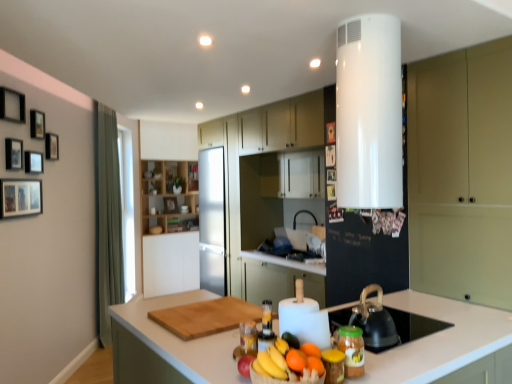
This screenshot has height=384, width=512. I want to click on white glossy water heater at upper center, so click(x=369, y=113).

What do you see at coordinates (330, 155) in the screenshot? This screenshot has width=512, height=384. I see `wooden picture frame at upper center, marked as the fourth picture frame in a right-to-left arrangement` at bounding box center [330, 155].

Find the location of `orange matte at center, arranged as the 1th orange when viewed from the back`. orange matte at center, arranged as the 1th orange when viewed from the back is located at coordinates pyautogui.click(x=310, y=350).

Who is bigger, wooden picture frame at upper left, marked as the third picture frame in a front-to-back arrangement, or wooden picture frame at upper center, placed as the 2th picture frame when sorted from right to left?

wooden picture frame at upper left, marked as the third picture frame in a front-to-back arrangement, is bigger.

Is wooden picture frame at upper left, the 9th picture frame viewed from the back, aimed at wooden picture frame at upper center, arranged as the tenth picture frame when viewed from the left?

Yes, wooden picture frame at upper left, the 9th picture frame viewed from the back, is turned towards wooden picture frame at upper center, arranged as the tenth picture frame when viewed from the left.

Looking at this image, which is more to the left, wooden picture frame at upper center, marked as the fifth picture frame in a back-to-front arrangement, or wooden picture frame at center, which ranks as the first picture frame in back-to-front order?

From the viewer's perspective, wooden picture frame at center, which ranks as the first picture frame in back-to-front order, appears more on the left side.

Based on their sizes in the image, would you say wooden picture frame at upper center, marked as the fourth picture frame in a right-to-left arrangement, is bigger or smaller than wooden picture frame at center, the seventh picture frame positioned from the left?

Considering their sizes, wooden picture frame at upper center, marked as the fourth picture frame in a right-to-left arrangement, takes up less space than wooden picture frame at center, the seventh picture frame positioned from the left.

From the image's perspective, is wooden picture frame at upper center, the 8th picture frame in the left-to-right sequence, beneath wooden picture frame at center, acting as the eleventh picture frame starting from the front?

Incorrect, from the image's perspective, wooden picture frame at upper center, the 8th picture frame in the left-to-right sequence, is higher than wooden picture frame at center, acting as the eleventh picture frame starting from the front.

Which orange is the 3rd one when counting from the front of the wooden shelves at center, which is the first cabinetry in back-to-front order? Please provide its 2D coordinates.

[(296, 360)]

Is wooden shelves at center, marked as the fourth cabinetry in a front-to-back arrangement, far away from orange matte at center, the third orange in the back-to-front sequence?

wooden shelves at center, marked as the fourth cabinetry in a front-to-back arrangement, is positioned a significant distance from orange matte at center, the third orange in the back-to-front sequence.

Considering the points (174, 229) and (302, 357), which point is in front, point (174, 229) or point (302, 357)?

The point (302, 357) is more forward.

Can you confirm if wooden shelves at center, marked as the fourth cabinetry in a front-to-back arrangement, is taller than orange matte at center, which is the first orange in front-to-back order?

Yes.

From the image's perspective, starting from the wooden picture frame at upper left, which is counted as the 7th picture frame, starting from the back, which cabinetry is the 1st one below? Please provide its 2D coordinates.

[(292, 174)]

In the scene shown: Is matte white cabinet at center, which ranks as the 2th cabinetry in right-to-left order, not close to wooden picture frame at upper left, the 2th picture frame viewed from the left?

Yes.

Based on their positions, is matte white cabinet at center, which is counted as the second cabinetry, starting from the front, located to the left or right of wooden picture frame at upper left, the 2th picture frame viewed from the left?

Clearly, matte white cabinet at center, which is counted as the second cabinetry, starting from the front, is on the right of wooden picture frame at upper left, the 2th picture frame viewed from the left, in the image.

Do you think orange matte at center, which is the first orange in front-to-back order, is within wooden cutting board at center, or outside of it?

orange matte at center, which is the first orange in front-to-back order, exists outside the volume of wooden cutting board at center.

Considering the relative positions of orange matte at center, the third orange in the back-to-front sequence, and wooden cutting board at center in the image provided, is orange matte at center, the third orange in the back-to-front sequence, to the left or to the right of wooden cutting board at center?

Based on their positions, orange matte at center, the third orange in the back-to-front sequence, is located to the right of wooden cutting board at center.

From a real-world perspective, is orange matte at center, which is the first orange in front-to-back order, located higher than wooden cutting board at center?

Yes, from a real-world perspective, orange matte at center, which is the first orange in front-to-back order, is over wooden cutting board at center

From the image's perspective, who appears lower, orange matte at center, which is the first orange in front-to-back order, or wooden cutting board at center?

wooden cutting board at center appears lower in the image.

Identify the location of curtain below the wooden picture frame at upper left, the 6th picture frame from the left (from a real-world perspective). Image resolution: width=512 pixels, height=384 pixels. (106, 220).

Considering the relative sizes of green fabric curtain at left and wooden picture frame at upper left, the sixth picture frame from the right, in the image provided, is green fabric curtain at left shorter than wooden picture frame at upper left, the sixth picture frame from the right,?

No, green fabric curtain at left is not shorter than wooden picture frame at upper left, the sixth picture frame from the right.

Can you confirm if green fabric curtain at left is positioned to the right of wooden picture frame at upper left, the 6th picture frame from the left?

Yes.

Is point (123, 330) positioned after point (359, 308)?

Yes, it is.

Considering the sizes of objects white glossy countertop at center and black matte tea pot at lower right in the image provided, who is bigger, white glossy countertop at center or black matte tea pot at lower right?

Bigger between the two is white glossy countertop at center.

Considering the sizes of objects white glossy countertop at center and black matte tea pot at lower right in the image provided, who is wider, white glossy countertop at center or black matte tea pot at lower right?

white glossy countertop at center.

Is white glossy countertop at center turned away from black matte tea pot at lower right?

No, white glossy countertop at center is not facing the opposite direction of black matte tea pot at lower right.

From the image's perspective, starting from the wooden picture frame at upper center, the fourth picture frame when ordered from back to front, which picture frame is the 2nd one above? Please provide its 2D coordinates.

[(14, 154)]

I want to click on the 5th picture frame directly above the wooden picture frame at center, which ranks as the first picture frame in back-to-front order (from a real-world perspective), so click(x=330, y=155).

Considering their positions, is wooden picture frame at upper center, placed as the sixth picture frame when sorted from back to front, positioned further to wooden picture frame at upper left, which is the fifth picture frame from left to right, than wooden shelves at center, marked as the fourth cabinetry in a right-to-left arrangement?

Among the two, wooden shelves at center, marked as the fourth cabinetry in a right-to-left arrangement, is located further to wooden picture frame at upper left, which is the fifth picture frame from left to right.

Based on their spatial positions, is wooden picture frame at upper center, which ranks as the 9th picture frame in left-to-right order, or satin white refrigerator at center, which is the third cabinetry in right-to-left order, closer to wooden picture frame at upper center, which is counted as the eighth picture frame, starting from the front?

Among the two, wooden picture frame at upper center, which ranks as the 9th picture frame in left-to-right order, is located nearer to wooden picture frame at upper center, which is counted as the eighth picture frame, starting from the front.

Considering their positions, is translucent plastic bottle at center, the second bottle when ordered from left to right, positioned further to satin white refrigerator at center, which is the third cabinetry in right-to-left order, than wooden picture frame at upper center, marked as the fifth picture frame in a back-to-front arrangement?

translucent plastic bottle at center, the second bottle when ordered from left to right, is further to satin white refrigerator at center, which is the third cabinetry in right-to-left order.

When comparing their distances from wooden picture frame at upper left, the 4th picture frame positioned from the left, does wooden picture frame at upper left, marked as the third picture frame in a front-to-back arrangement, or wooden picture frame at center, acting as the eleventh picture frame starting from the front, seem closer?

Based on the image, wooden picture frame at upper left, marked as the third picture frame in a front-to-back arrangement, appears to be nearer to wooden picture frame at upper left, the 4th picture frame positioned from the left.

From the image, which object appears to be nearer to wooden picture frame at upper left, the sixth picture frame from the right, wooden picture frame at upper left, the 9th picture frame positioned from the right, or matte green cabinet at right, placed as the first cabinetry when sorted from front to back?

Among the two, wooden picture frame at upper left, the 9th picture frame positioned from the right, is located nearer to wooden picture frame at upper left, the sixth picture frame from the right.

Considering their positions, is wooden picture frame at upper left, placed as the 10th picture frame when sorted from front to back, positioned closer to wooden picture frame at upper left, the eleventh picture frame in the back-to-front sequence, than orange matte at center, the second orange positioned from the front?

Based on the image, wooden picture frame at upper left, placed as the 10th picture frame when sorted from front to back, appears to be nearer to wooden picture frame at upper left, the eleventh picture frame in the back-to-front sequence.

Looking at the image, which one is located closer to wooden picture frame at upper center, placed as the sixth picture frame when sorted from back to front, orange matte at center, the second orange positioned from the front, or wooden picture frame at upper center, arranged as the tenth picture frame when viewed from the left?

Among the two, wooden picture frame at upper center, arranged as the tenth picture frame when viewed from the left, is located nearer to wooden picture frame at upper center, placed as the sixth picture frame when sorted from back to front.

When comparing their distances from translucent glass jar at center, marked as the first bottle in a back-to-front arrangement, does shiny golden bananas at center or wooden shelves at center, which is the 1th cabinetry from left to right, seem closer?

Among the two, shiny golden bananas at center is located nearer to translucent glass jar at center, marked as the first bottle in a back-to-front arrangement.

Identify the location of curtain between wooden picture frame at upper center, the 9th picture frame from the front, and wooden shelves at center, marked as the fourth cabinetry in a right-to-left arrangement, along the z-axis. This screenshot has width=512, height=384. (106, 220).

You are a GUI agent. You are given a task and a screenshot of the screen. Output one action in this format:
    pyautogui.click(x=<x>, y=<y>)
    Task: Click on the bottle between wooden picture frame at upper left, the 4th picture frame positioned from the left, and translucent plastic bottle at center, placed as the 2th bottle when sorted from front to back, from left to right
    
    Given the screenshot: What is the action you would take?
    pyautogui.click(x=248, y=338)

At what (x,y) coordinates should I click in order to perform the action: click on cabinetry between matte white cabinet at center, which ranks as the 2th cabinetry in right-to-left order, and wooden shelves at center, marked as the fourth cabinetry in a front-to-back arrangement, along the z-axis. Please return your answer as a coordinate pair (x, y). Looking at the image, I should click on (270, 182).

Find the location of a particular element. Image resolution: width=512 pixels, height=384 pixels. bottle between translucent plastic bottle at center, which appears as the 2th bottle when viewed from the back, and green fabric curtain at left in the front-back direction is located at coordinates (248, 338).